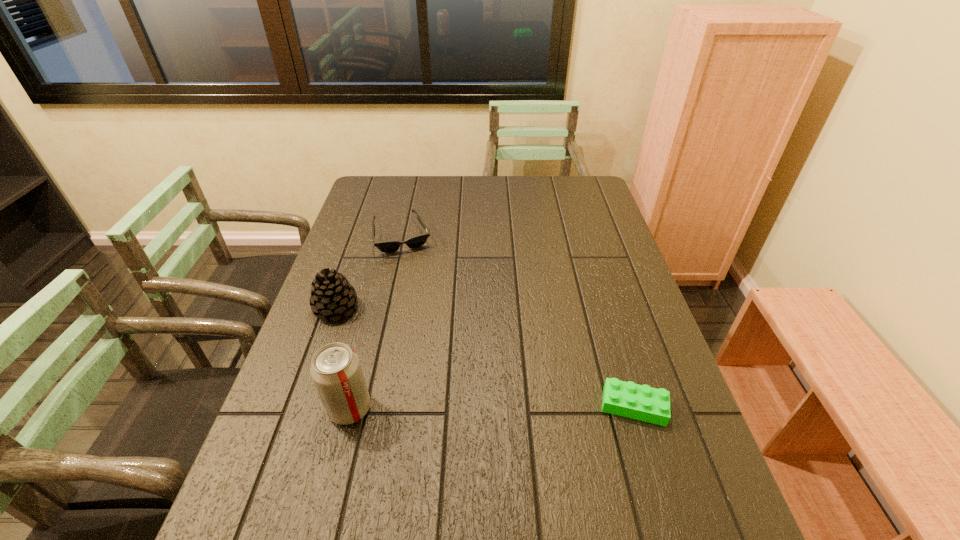
Where is `vacant space located 0.170m on the front-facing side of the farthest object`? The image size is (960, 540). vacant space located 0.170m on the front-facing side of the farthest object is located at coordinates (419, 290).

Where is `vacant space located 0.250m on the front-facing side of the farthest object`? The width and height of the screenshot is (960, 540). vacant space located 0.250m on the front-facing side of the farthest object is located at coordinates (424, 309).

Where is `vacant region located 0.210m on the front-facing side of the farthest object`? The width and height of the screenshot is (960, 540). vacant region located 0.210m on the front-facing side of the farthest object is located at coordinates coord(421,299).

This screenshot has height=540, width=960. I want to click on soda can located in the left edge section of the desktop, so click(x=336, y=371).

This screenshot has width=960, height=540. I want to click on pinecone that is at the left edge, so click(332, 296).

Identify the location of sunglasses present at the left edge. (416, 241).

The height and width of the screenshot is (540, 960). What are the coordinates of `object that is at the right edge` in the screenshot? It's located at (641, 402).

Where is `free space at the far edge of the desktop`? This screenshot has width=960, height=540. free space at the far edge of the desktop is located at coordinates [476, 207].

The height and width of the screenshot is (540, 960). What are the coordinates of `vacant region at the near edge of the desktop` in the screenshot? It's located at (368, 470).

In the image, there is a desktop. Where is `vacant region at the right edge`? The image size is (960, 540). vacant region at the right edge is located at coordinates (565, 221).